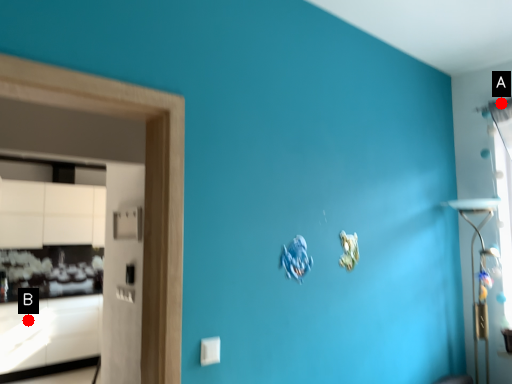
Question: Two points are circled on the image, labeled by A and B beside each circle. Which point is closer to the camera taking this photo?

Choices:
 (A) A is closer
 (B) B is closer

Answer: (A)